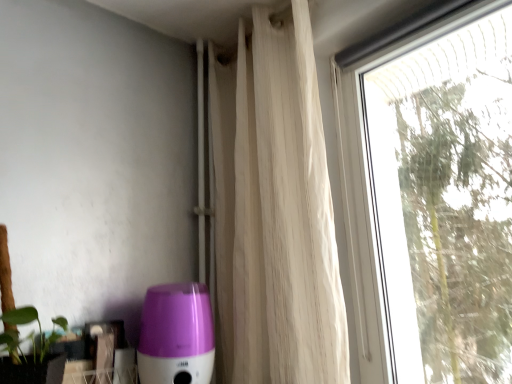
Based on the photo, what is the approximate width of white sheer curtain at upper right?

The width of white sheer curtain at upper right is 7.53 inches.

This screenshot has width=512, height=384. In order to click on purple glossy humidifier at lower left in this screenshot , I will do `click(176, 335)`.

Is purple glossy humidifier at lower left positioned beyond the bounds of white sheer curtain at upper right?

Absolutely, purple glossy humidifier at lower left is external to white sheer curtain at upper right.

Find the location of a particular element. This screenshot has height=384, width=512. appliance lying behind the white sheer curtain at upper right is located at coordinates (176, 335).

Is purple glossy humidifier at lower left facing towards white sheer curtain at upper right?

No, purple glossy humidifier at lower left is not aimed at white sheer curtain at upper right.

Measure the distance from purple glossy humidifier at lower left to white sheer curtain at upper right.

A distance of 14.31 inches exists between purple glossy humidifier at lower left and white sheer curtain at upper right.

From the image's perspective, which is above, white sheer curtain at upper right or transparent glass window at right?

white sheer curtain at upper right appears higher in the image.

Consider the image. Measure the distance between white sheer curtain at upper right and transparent glass window at right.

white sheer curtain at upper right is 27.00 inches away from transparent glass window at right.

Is white sheer curtain at upper right placed right next to transparent glass window at right?

white sheer curtain at upper right is not next to transparent glass window at right, and they're not touching.

From the image's perspective, is white sheer curtain at upper right under purple glossy humidifier at lower left?

Actually, white sheer curtain at upper right appears above purple glossy humidifier at lower left in the image.

Between point (215, 148) and point (166, 321), which one is positioned behind?

The point (215, 148) is farther from the camera.

Is white sheer curtain at upper right next to purple glossy humidifier at lower left?

There is a gap between white sheer curtain at upper right and purple glossy humidifier at lower left.

Is white sheer curtain at upper right spatially inside purple glossy humidifier at lower left, or outside of it?

white sheer curtain at upper right is spatially situated outside purple glossy humidifier at lower left.

Considering the relative positions of purple glossy humidifier at lower left and transparent glass window at right in the image provided, is purple glossy humidifier at lower left to the left of transparent glass window at right from the viewer's perspective?

Indeed, purple glossy humidifier at lower left is positioned on the left side of transparent glass window at right.

Which of these two, purple glossy humidifier at lower left or transparent glass window at right, is bigger?

transparent glass window at right is bigger.

Image resolution: width=512 pixels, height=384 pixels. What are the coordinates of `appliance located underneath the transparent glass window at right (from a real-world perspective)` in the screenshot? It's located at (176, 335).

Is point (145, 315) closer to viewer compared to point (349, 100)?

Yes, point (145, 315) is in front of point (349, 100).

Can you confirm if transparent glass window at right is positioned to the left of white sheer curtain at upper right?

In fact, transparent glass window at right is to the right of white sheer curtain at upper right.

From the picture: Considering the relative sizes of transparent glass window at right and white sheer curtain at upper right in the image provided, is transparent glass window at right thinner than white sheer curtain at upper right?

Correct, the width of transparent glass window at right is less than that of white sheer curtain at upper right.

Is transparent glass window at right behind white sheer curtain at upper right?

No, it is in front of white sheer curtain at upper right.

How many degrees apart are the facing directions of transparent glass window at right and purple glossy humidifier at lower left?

There is a 90.2-degree angle between the facing directions of transparent glass window at right and purple glossy humidifier at lower left.

From a real-world perspective, between transparent glass window at right and purple glossy humidifier at lower left, who is vertically higher?

transparent glass window at right, from a real-world perspective.

Between transparent glass window at right and purple glossy humidifier at lower left, which one has larger width?

Wider between the two is purple glossy humidifier at lower left.

Considering the positions of point (438, 187) and point (158, 320), is point (438, 187) closer or farther from the camera than point (158, 320)?

Clearly, point (438, 187) is more distant from the camera than point (158, 320).

Locate an element on the screen. Image resolution: width=512 pixels, height=384 pixels. appliance on the left of white sheer curtain at upper right is located at coordinates (176, 335).

I want to click on curtain that is above the transparent glass window at right (from a real-world perspective), so click(274, 210).

From the image, which object appears to be farther from white sheer curtain at upper right, purple glossy humidifier at lower left or transparent glass window at right?

The object further to white sheer curtain at upper right is transparent glass window at right.

Looking at the image, which one is located closer to purple glossy humidifier at lower left, transparent glass window at right or white sheer curtain at upper right?

white sheer curtain at upper right is positioned closer to the anchor purple glossy humidifier at lower left.

Based on their spatial positions, is transparent glass window at right or purple glossy humidifier at lower left further from white sheer curtain at upper right?

Among the two, transparent glass window at right is located further to white sheer curtain at upper right.

Which object lies nearer to the anchor point transparent glass window at right, white sheer curtain at upper right or purple glossy humidifier at lower left?

white sheer curtain at upper right is closer to transparent glass window at right.

When comparing their distances from purple glossy humidifier at lower left, does white sheer curtain at upper right or transparent glass window at right seem closer?

white sheer curtain at upper right is closer to purple glossy humidifier at lower left.

Considering their positions, is purple glossy humidifier at lower left positioned closer to transparent glass window at right than white sheer curtain at upper right?

white sheer curtain at upper right lies closer to transparent glass window at right than the other object.

You are a GUI agent. You are given a task and a screenshot of the screen. Output one action in this format:
    pyautogui.click(x=<x>, y=<y>)
    Task: Click on the curtain between purple glossy humidifier at lower left and transparent glass window at right
    Image resolution: width=512 pixels, height=384 pixels.
    Given the screenshot: What is the action you would take?
    pyautogui.click(x=274, y=210)